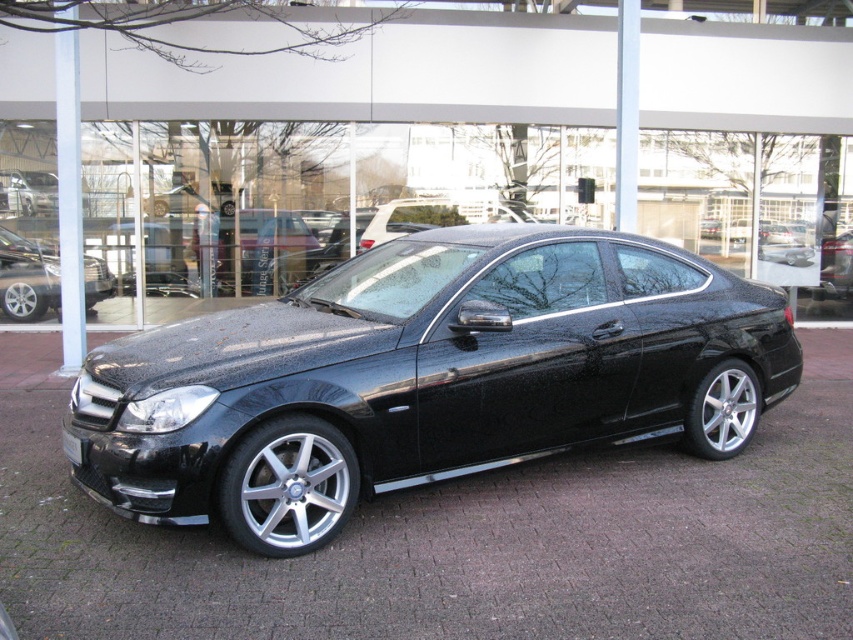
Question: Is shiny metallic car at center smaller than black glossy license plate at front?

Choices:
 (A) no
 (B) yes

Answer: (A)

Question: Among these points, which one is farthest from the camera?

Choices:
 (A) (56, 250)
 (B) (68, 442)
 (C) (593, 321)

Answer: (A)

Question: Is shiny metallic car at center above black glossy license plate at front?

Choices:
 (A) no
 (B) yes

Answer: (B)

Question: Based on their relative distances, which object is farther from the black metallic car at center?

Choices:
 (A) black glossy license plate at front
 (B) shiny metallic car at center

Answer: (B)

Question: Is black metallic car at center positioned behind black glossy license plate at front?

Choices:
 (A) no
 (B) yes

Answer: (A)

Question: Based on their relative distances, which object is nearer to the black glossy license plate at front?

Choices:
 (A) shiny metallic car at center
 (B) black metallic car at center

Answer: (B)